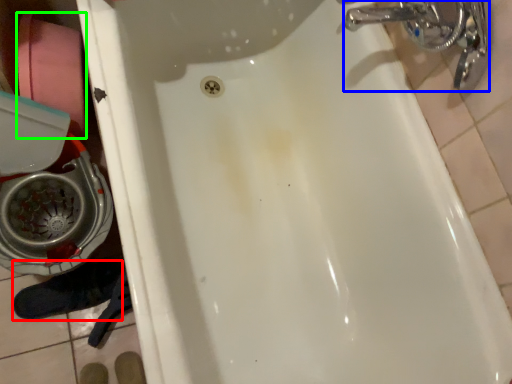
Question: Considering the real-world distances, which object is closest to shoe (highlighted by a red box)? plumbing fixture (highlighted by a blue box) or toilet paper (highlighted by a green box).

Choices:
 (A) plumbing fixture
 (B) toilet paper

Answer: (B)